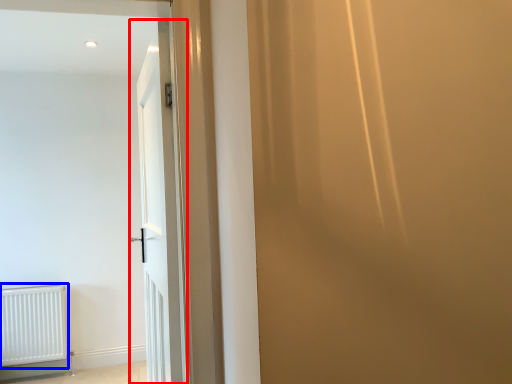
Question: Which object is further to the camera taking this photo, door (highlighted by a red box) or radiator (highlighted by a blue box)?

Choices:
 (A) door
 (B) radiator

Answer: (B)